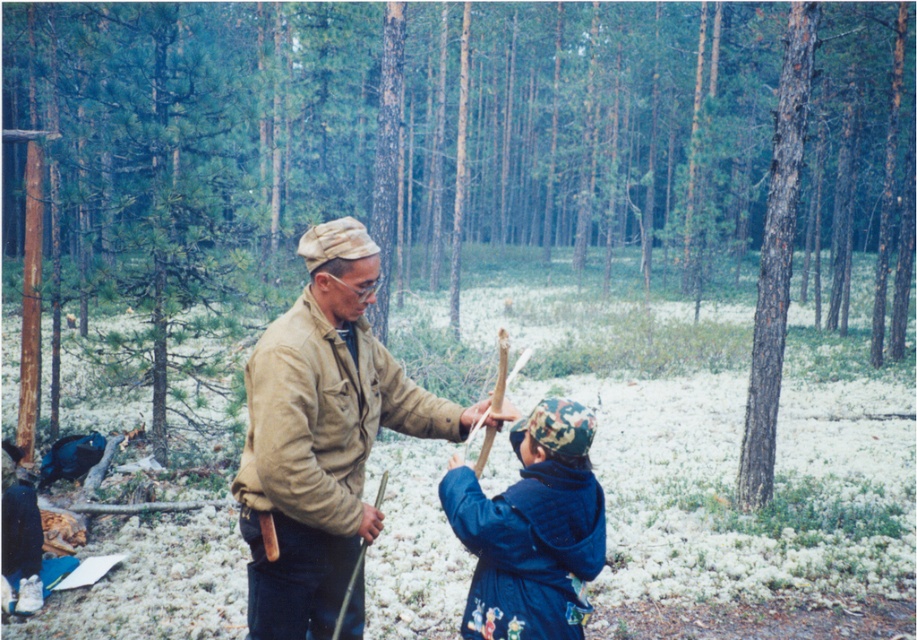
You are standing at the origin point in the forest scene. You need to move towards the point at coordinates point (349, 352) and point (564, 403). Which point should you reach first if you move in a straight line from your current position?

You should reach point (564, 403) first because point (349, 352) is behind it relative to your starting position at the origin.